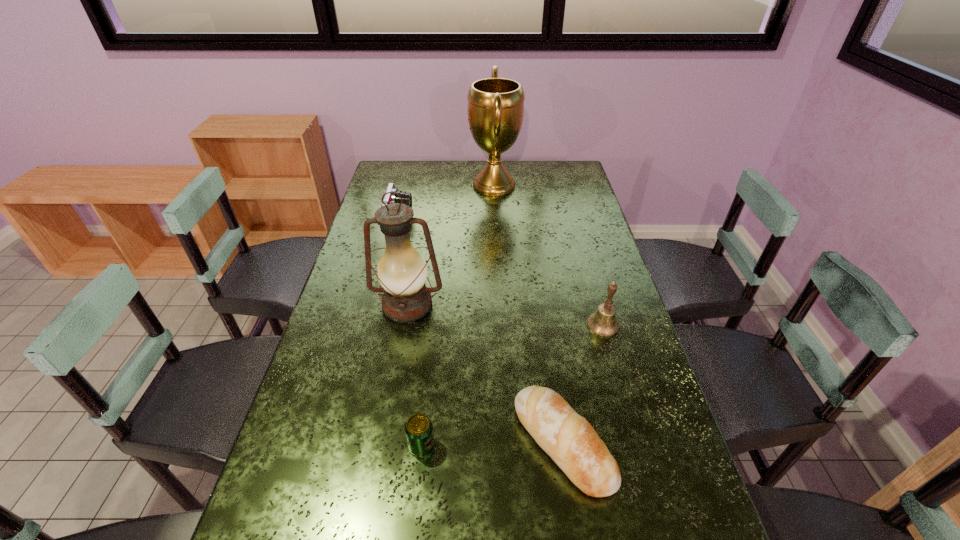
Find the location of a particular element. This screenshot has height=540, width=960. vacant space at the far edge of the desktop is located at coordinates (428, 183).

Locate an element on the screen. The width and height of the screenshot is (960, 540). free space at the left edge of the desktop is located at coordinates (321, 372).

This screenshot has width=960, height=540. Identify the location of vacant point at the right edge. (601, 301).

The image size is (960, 540). Identify the location of free space between the bell and the trophy cup. (548, 255).

This screenshot has height=540, width=960. Find the location of `free area in between the oil lamp and the beer can`. free area in between the oil lamp and the beer can is located at coordinates (415, 375).

Where is `vacant area that lies between the third shortest object and the bread`? This screenshot has width=960, height=540. vacant area that lies between the third shortest object and the bread is located at coordinates (481, 332).

I want to click on free spot between the third tallest object and the bread, so click(x=583, y=384).

Find the location of a particular element. This screenshot has height=540, width=960. free space between the rightmost object and the trophy cup is located at coordinates (548, 255).

This screenshot has height=540, width=960. I want to click on free area in between the beer can and the trophy cup, so pos(458,315).

Where is `free space between the fourth shortest object and the beer can`? The image size is (960, 540). free space between the fourth shortest object and the beer can is located at coordinates (513, 386).